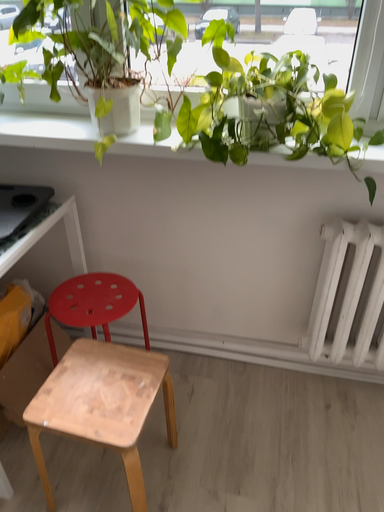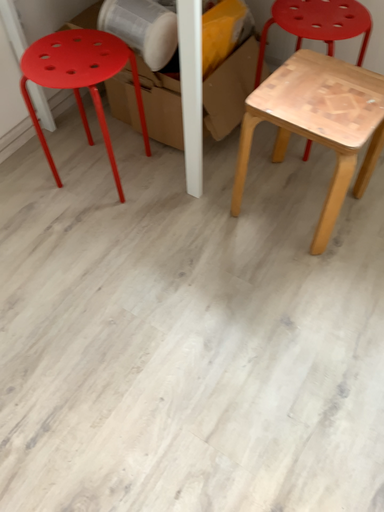
Question: Which way did the camera rotate in the video?

Choices:
 (A) rotated upward
 (B) rotated downward

Answer: (B)